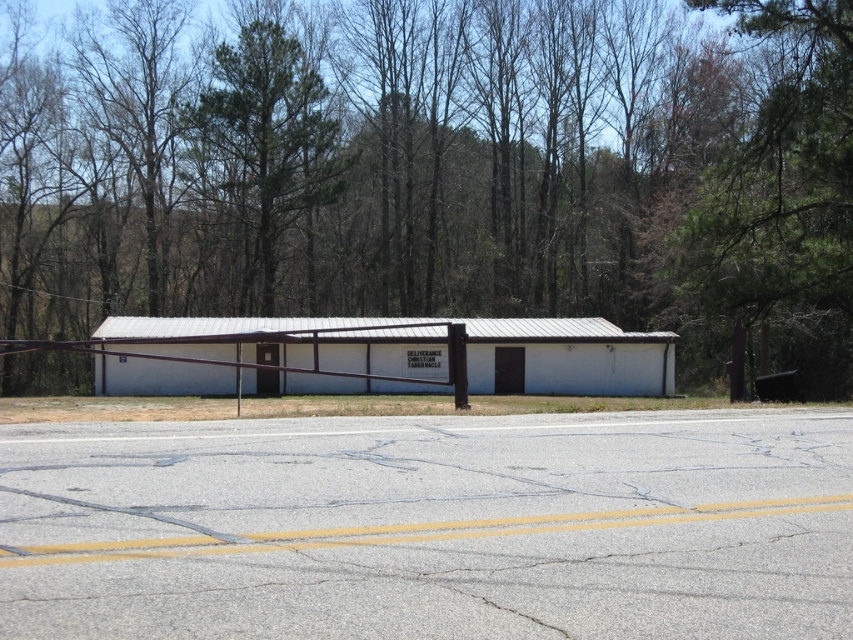
Is green leafy tree at center above green leafy tree at upper center?

Actually, green leafy tree at center is below green leafy tree at upper center.

Is green leafy tree at center shorter than green leafy tree at upper center?

No.

What do you see at coordinates (440, 170) in the screenshot?
I see `green leafy tree at center` at bounding box center [440, 170].

The width and height of the screenshot is (853, 640). I want to click on green leafy tree at center, so click(440, 170).